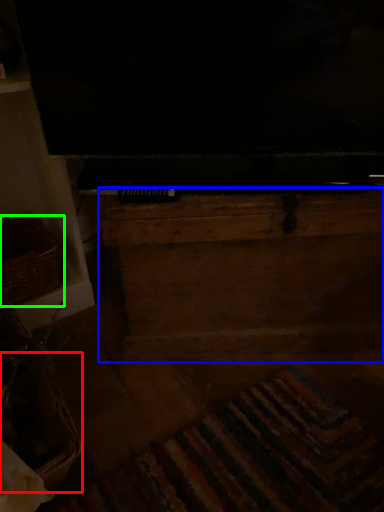
Question: Considering the real-world distances, which object is closest to basket (highlighted by a red box)? dresser (highlighted by a blue box) or basket (highlighted by a green box).

Choices:
 (A) dresser
 (B) basket

Answer: (B)